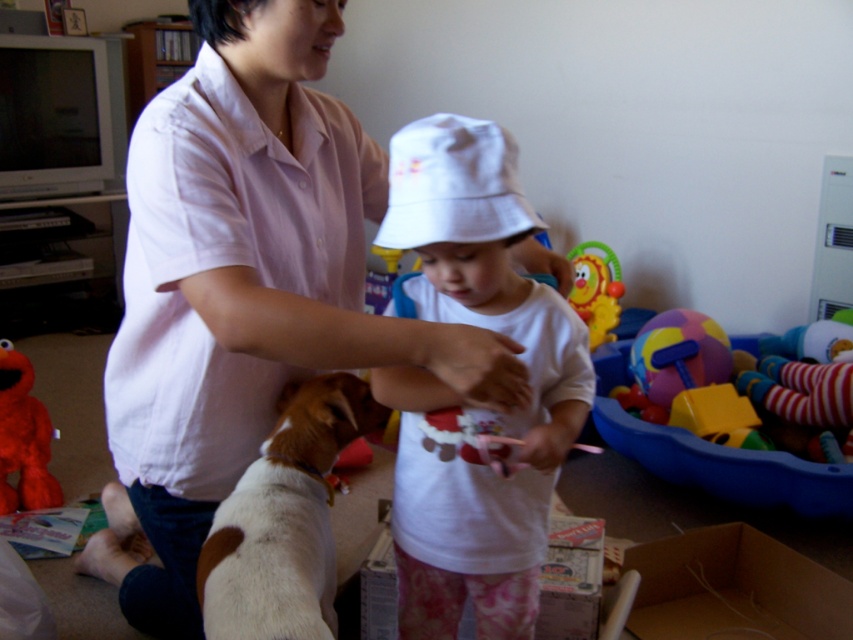
Can you confirm if white cotton hat at center is positioned above brown and white fur at lower left?

Indeed, white cotton hat at center is positioned over brown and white fur at lower left.

From the picture: Does white cotton hat at center have a smaller size compared to brown and white fur at lower left?

Actually, white cotton hat at center might be larger than brown and white fur at lower left.

Who is more distant from viewer, (421,184) or (305,634)?

The point (421,184) is more distant.

Identify the location of white cotton hat at center. (463, 400).

Can you confirm if matte pink shirt at center is thinner than plastic yellow lion at center?

Incorrect, matte pink shirt at center's width is not less than plastic yellow lion at center's.

Who is positioned more to the left, matte pink shirt at center or plastic yellow lion at center?

matte pink shirt at center is more to the left.

What are the coordinates of `matte pink shirt at center` in the screenshot? It's located at (242, 289).

Where is `matte pink shirt at center`? The height and width of the screenshot is (640, 853). matte pink shirt at center is located at coordinates (242, 289).

Is matte pink shirt at center bigger than brown and white fur at lower left?

Yes.

Is matte pink shirt at center positioned before brown and white fur at lower left?

No, matte pink shirt at center is further to the viewer.

Does point (344, 294) come closer to viewer compared to point (271, 566)?

No, it is not.

Where is `matte pink shirt at center`? This screenshot has width=853, height=640. matte pink shirt at center is located at coordinates (242, 289).